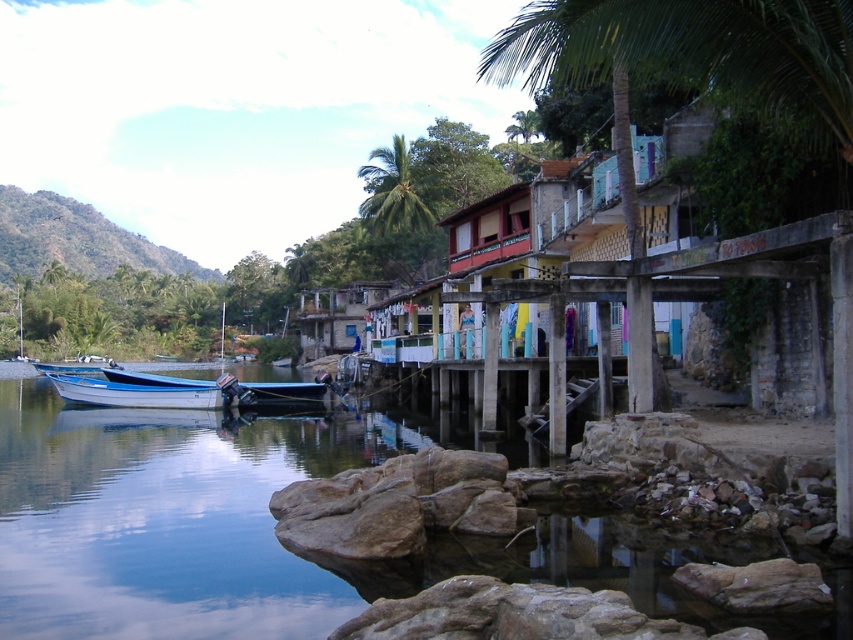
Question: Can you confirm if blue glossy water at lower left is positioned to the left of green leafy palm tree at center?

Choices:
 (A) no
 (B) yes

Answer: (A)

Question: Does blue glossy water at lower left lie behind white glossy boat at lower left?

Choices:
 (A) yes
 (B) no

Answer: (B)

Question: Is rustic wooden hut at center positioned behind blue matte boat at left?

Choices:
 (A) no
 (B) yes

Answer: (B)

Question: Based on their relative distances, which object is farther from the blue matte boat at left?

Choices:
 (A) white glossy boat at lower left
 (B) rustic wooden hut at center
 (C) green leafy palm tree at center

Answer: (C)

Question: Which of the following is the closest to the observer?

Choices:
 (A) (134, 406)
 (B) (399, 189)

Answer: (A)

Question: Which of the following is the closest to the observer?

Choices:
 (A) (396, 180)
 (B) (833, 620)
 (C) (114, 365)
 (D) (364, 284)

Answer: (B)